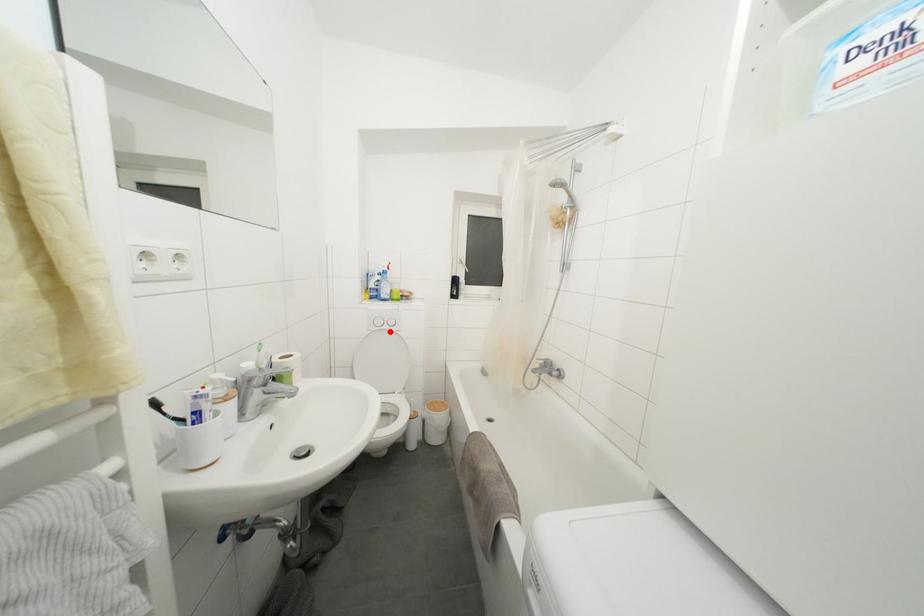
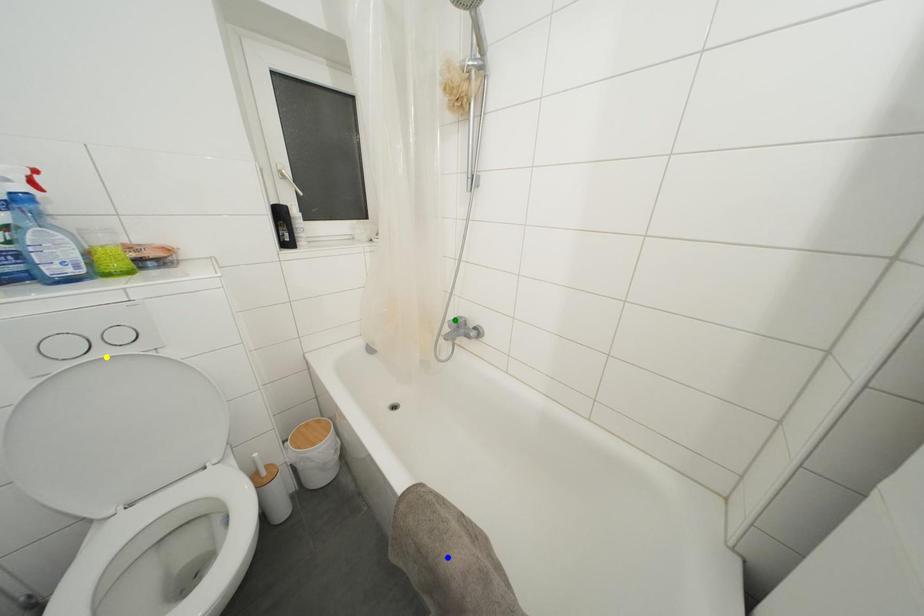
Question: I am providing you with two images of the same scene from different viewpoints. A red point is marked on the first image. You are given multiple points on the second image. Which spot in image 2 lines up with the point in image 1?

Choices:
 (A) green point
 (B) yellow point
 (C) blue point

Answer: (B)